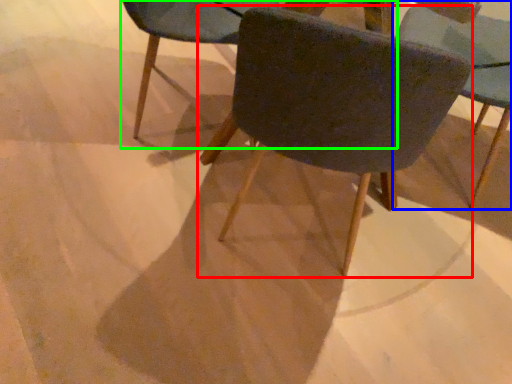
Question: Which is nearer to the chair (highlighted by a red box)? chair (highlighted by a blue box) or chair (highlighted by a green box).

Choices:
 (A) chair
 (B) chair

Answer: (B)